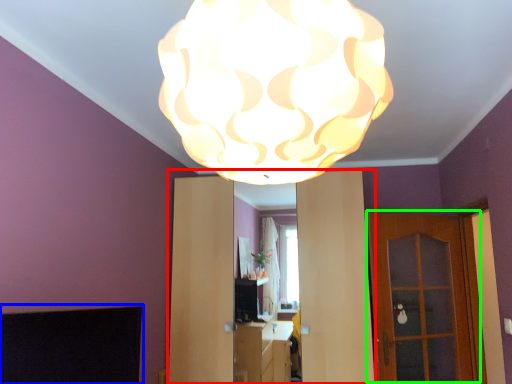
Question: Based on their relative distances, which object is nearer to dresser (highlighted by a red box)? Choose from fireplace (highlighted by a blue box) and door (highlighted by a green box).

Choices:
 (A) fireplace
 (B) door

Answer: (B)